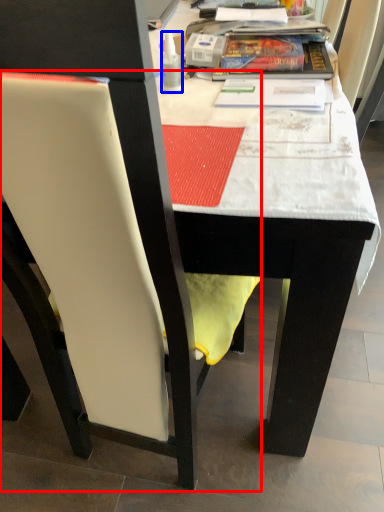
Question: Which object appears closest to the camera in this image, chair (highlighted by a red box) or bottle (highlighted by a blue box)?

Choices:
 (A) chair
 (B) bottle

Answer: (A)